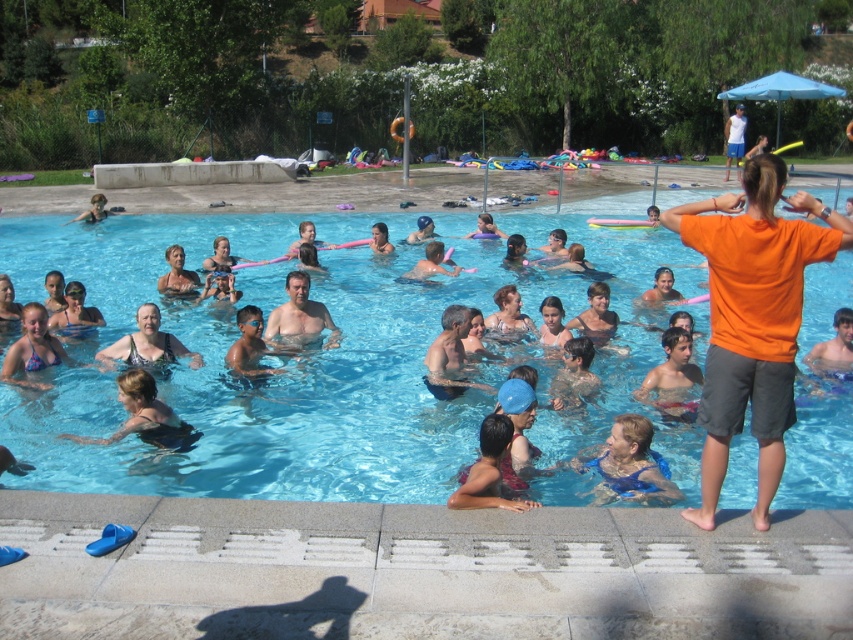
Who is shorter, smooth skin man at center or matte black swimsuit at center?

matte black swimsuit at center

Between smooth skin man at center and matte black swimsuit at center, which one is positioned higher?

smooth skin man at center

What do you see at coordinates (299, 317) in the screenshot? I see `smooth skin man at center` at bounding box center [299, 317].

Where is `smooth skin man at center`? The width and height of the screenshot is (853, 640). smooth skin man at center is located at coordinates (299, 317).

Consider the image. Between transparent blue water at center and smooth skin man at center, which one has less height?

Standing shorter between the two is smooth skin man at center.

Does transparent blue water at center lie in front of smooth skin man at center?

Yes, it is.

Locate an element on the screen. The height and width of the screenshot is (640, 853). transparent blue water at center is located at coordinates (265, 362).

This screenshot has width=853, height=640. What do you see at coordinates (265, 362) in the screenshot?
I see `transparent blue water at center` at bounding box center [265, 362].

You are a GUI agent. You are given a task and a screenshot of the screen. Output one action in this format:
    pyautogui.click(x=<x>, y=<y>)
    Task: Click on the transparent blue water at center
    The height and width of the screenshot is (640, 853).
    Given the screenshot: What is the action you would take?
    pyautogui.click(x=265, y=362)